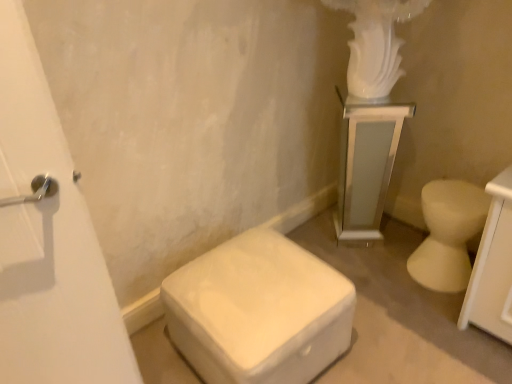
Question: Is white matte ottoman at lower center, which ranks as the 2th toilet in right-to-left order, positioned far away from white glossy toilet at right, the 2th toilet positioned from the left?

Choices:
 (A) no
 (B) yes

Answer: (A)

Question: From a real-world perspective, is white matte ottoman at lower center, which ranks as the 2th toilet in right-to-left order, below white glossy toilet at right, which is the 1th toilet from right to left?

Choices:
 (A) no
 (B) yes

Answer: (A)

Question: Considering the relative sizes of white matte ottoman at lower center, which ranks as the 2th toilet in right-to-left order, and white glossy toilet at right, the 2th toilet positioned from the left, in the image provided, is white matte ottoman at lower center, which ranks as the 2th toilet in right-to-left order, bigger than white glossy toilet at right, the 2th toilet positioned from the left,?

Choices:
 (A) no
 (B) yes

Answer: (B)

Question: Is white matte ottoman at lower center, which ranks as the first toilet in left-to-right order, thinner than white glossy toilet at right, which is the 1th toilet from right to left?

Choices:
 (A) no
 (B) yes

Answer: (A)

Question: Does white matte ottoman at lower center, which ranks as the 2th toilet in right-to-left order, have a greater height compared to white glossy toilet at right, the 2th toilet positioned from the left?

Choices:
 (A) no
 (B) yes

Answer: (A)

Question: Considering the relative positions of white glossy toilet at right, the 2th toilet positioned from the left, and white matte ottoman at lower center, which ranks as the first toilet in left-to-right order, in the image provided, is white glossy toilet at right, the 2th toilet positioned from the left, to the left or to the right of white matte ottoman at lower center, which ranks as the first toilet in left-to-right order,?

Choices:
 (A) left
 (B) right

Answer: (B)

Question: Is point (430, 279) positioned closer to the camera than point (300, 263)?

Choices:
 (A) farther
 (B) closer

Answer: (A)

Question: From their relative heights in the image, would you say white glossy toilet at right, which is the 1th toilet from right to left, is taller or shorter than white matte ottoman at lower center, which ranks as the first toilet in left-to-right order?

Choices:
 (A) short
 (B) tall

Answer: (B)

Question: Considering the positions of white glossy toilet at right, which is the 1th toilet from right to left, and white matte ottoman at lower center, which ranks as the 2th toilet in right-to-left order, in the image, is white glossy toilet at right, which is the 1th toilet from right to left, wider or thinner than white matte ottoman at lower center, which ranks as the 2th toilet in right-to-left order,?

Choices:
 (A) wide
 (B) thin

Answer: (B)

Question: In terms of height, does white glossy pedestal at upper right look taller or shorter compared to white glossy toilet at right, which is the 1th toilet from right to left?

Choices:
 (A) short
 (B) tall

Answer: (B)

Question: Is white glossy pedestal at upper right in front of or behind white glossy toilet at right, the 2th toilet positioned from the left, in the image?

Choices:
 (A) front
 (B) behind

Answer: (B)

Question: Would you say white glossy pedestal at upper right is inside or outside white glossy toilet at right, the 2th toilet positioned from the left?

Choices:
 (A) inside
 (B) outside

Answer: (B)

Question: Is point (358, 165) closer or farther from the camera than point (452, 274)?

Choices:
 (A) farther
 (B) closer

Answer: (A)

Question: From a real-world perspective, relative to white glossy pedestal at upper right, is white matte ottoman at lower center, which ranks as the 2th toilet in right-to-left order, vertically above or below?

Choices:
 (A) below
 (B) above

Answer: (A)

Question: In terms of height, does white matte ottoman at lower center, which ranks as the first toilet in left-to-right order, look taller or shorter compared to white glossy pedestal at upper right?

Choices:
 (A) tall
 (B) short

Answer: (B)